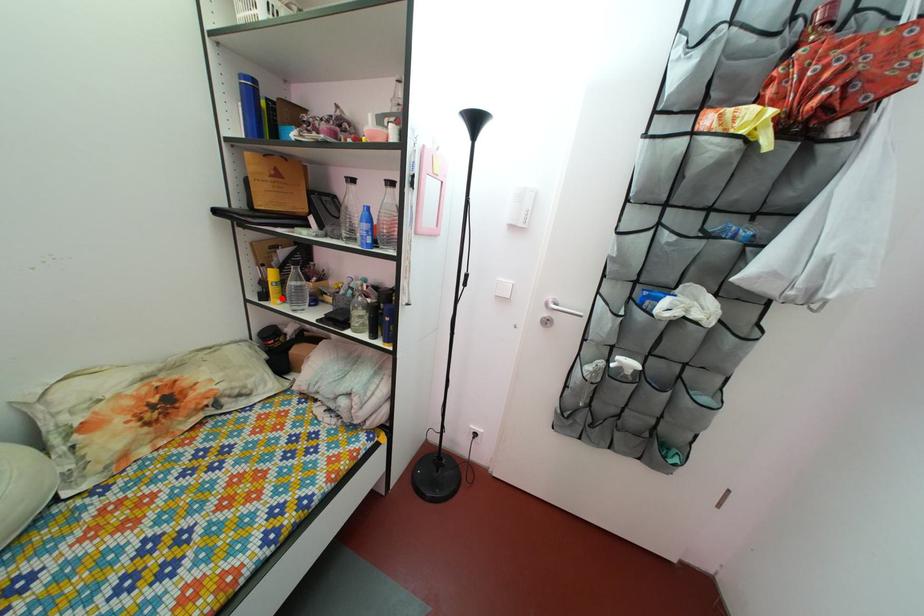
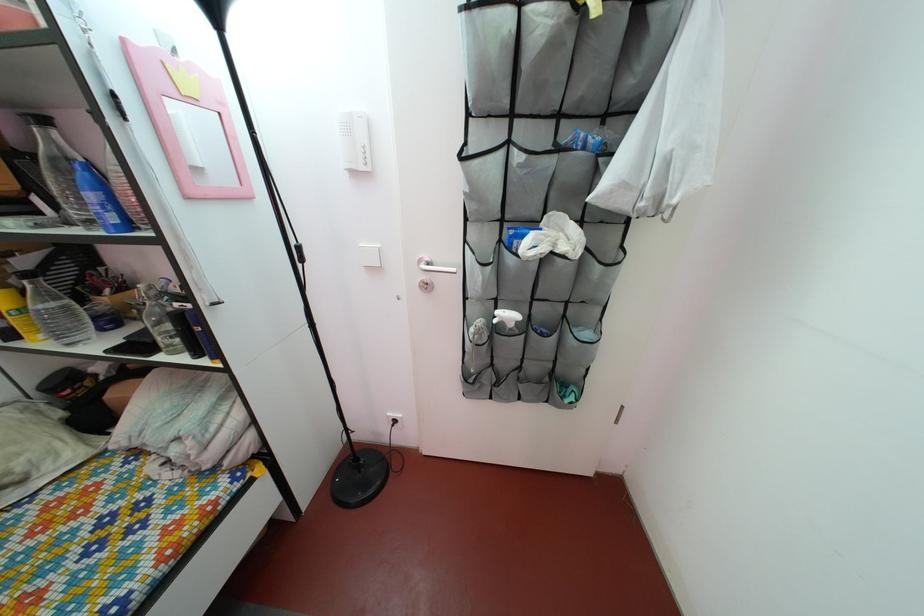
The point at the highlighted location is marked in the first image. Where is the corresponding point in the second image?

(27, 330)